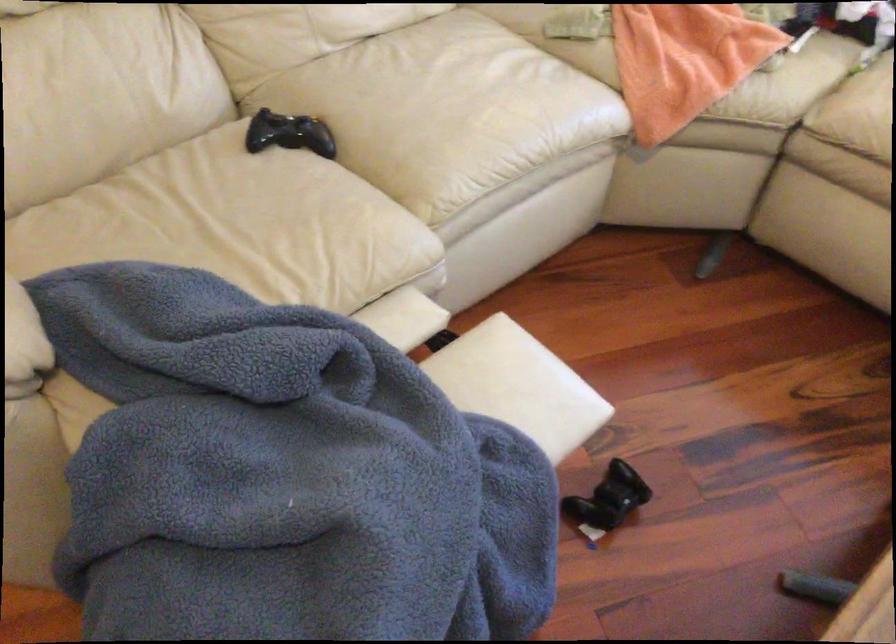
This screenshot has width=896, height=644. In order to click on white sofa cushion in this screenshot , I will do `click(237, 225)`.